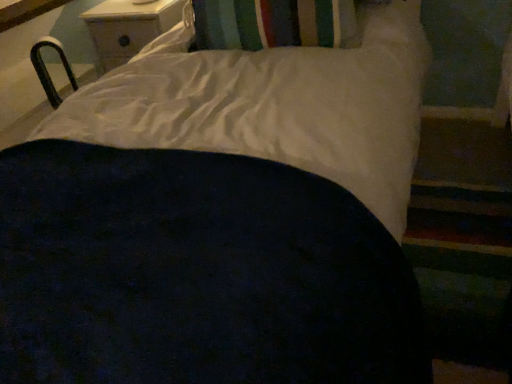
This screenshot has height=384, width=512. What do you see at coordinates (47, 70) in the screenshot?
I see `black metal/hard at left` at bounding box center [47, 70].

Image resolution: width=512 pixels, height=384 pixels. I want to click on black metal/hard at left, so click(x=47, y=70).

Where is `black metal/hard at left`? The image size is (512, 384). black metal/hard at left is located at coordinates (47, 70).